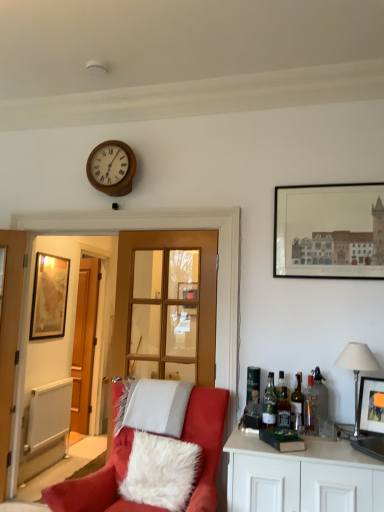
Locate an element on the screen. suede red chair at lower left is located at coordinates (98, 485).

In the scene shown: Measure the distance between point (291, 414) and camera.

The distance of point (291, 414) from camera is 2.46 meters.

Identify the location of clear glass wine bottle at right. [297, 406].

This screenshot has height=512, width=384. In order to click on green glass bottle at right, which is counted as the 4th bottle, starting from the right in this screenshot , I will do `click(269, 403)`.

This screenshot has height=512, width=384. What do you see at coordinates (49, 297) in the screenshot?
I see `matte gold picture frame at left, which appears as the 1th picture frame when viewed from the left` at bounding box center [49, 297].

This screenshot has width=384, height=512. What do you see at coordinates (357, 367) in the screenshot? I see `silver metallic lampshade at right` at bounding box center [357, 367].

The image size is (384, 512). What do you see at coordinates (283, 407) in the screenshot?
I see `translucent glass bottle at right, the 3th bottle from the right` at bounding box center [283, 407].

This screenshot has width=384, height=512. Find the location of `suede red chair at lower left`. suede red chair at lower left is located at coordinates (98, 485).

Considering the sizes of suede red chair at lower left and translucent glass bottle at right, the 4th bottle from the left, in the image, is suede red chair at lower left taller or shorter than translucent glass bottle at right, the 4th bottle from the left,?

Clearly, suede red chair at lower left is taller compared to translucent glass bottle at right, the 4th bottle from the left.

In terms of width, does suede red chair at lower left look wider or thinner when compared to translucent glass bottle at right, the 3th bottle from the right?

Clearly, suede red chair at lower left has more width compared to translucent glass bottle at right, the 3th bottle from the right.

Are suede red chair at lower left and translucent glass bottle at right, the 4th bottle from the left, located far from each other?

No, suede red chair at lower left is in close proximity to translucent glass bottle at right, the 4th bottle from the left.

Does green glass bottle at right, the 3th bottle from the left, have a lesser height compared to clear glass bottle at right, which is counted as the 1th bottle, starting from the right?

Indeed, green glass bottle at right, the 3th bottle from the left, has a lesser height compared to clear glass bottle at right, which is counted as the 1th bottle, starting from the right.

Is clear glass bottle at right, which is counted as the 1th bottle, starting from the right, inside green glass bottle at right, the 3th bottle from the left?

No, clear glass bottle at right, which is counted as the 1th bottle, starting from the right, is not surrounded by green glass bottle at right, the 3th bottle from the left.

Which is more to the left, green glass bottle at right, the 3th bottle from the left, or clear glass bottle at right, which ranks as the sixth bottle in left-to-right order?

Positioned to the left is green glass bottle at right, the 3th bottle from the left.

From the image's perspective, who appears lower, green glass bottle at right, which is counted as the 4th bottle, starting from the right, or clear glass bottle at right, which is counted as the 1th bottle, starting from the right?

green glass bottle at right, which is counted as the 4th bottle, starting from the right, appears lower in the image.

Is wooden door at left aimed at clear glass bottle at right, the 2th bottle from the right?

No, wooden door at left is not turned towards clear glass bottle at right, the 2th bottle from the right.

Which is more to the left, wooden door at left or clear glass bottle at right, the 2th bottle from the right?

From the viewer's perspective, wooden door at left appears more on the left side.

Between wooden door at left and clear glass bottle at right, the 5th bottle positioned from the left, which one is positioned in front?

Positioned in front is clear glass bottle at right, the 5th bottle positioned from the left.

From a real-world perspective, is wooden door at left physically below clear glass bottle at right, the 5th bottle positioned from the left?

No, from a real-world perspective, wooden door at left is not beneath clear glass bottle at right, the 5th bottle positioned from the left.

Could you tell me if translucent glass bottle at right, arranged as the first bottle when viewed from the left, is turned towards translucent glass bottle at right, arranged as the second bottle when viewed from the left?

No.

This screenshot has height=512, width=384. Find the location of `the 1st bottle in front of the translucent glass bottle at right, arranged as the second bottle when viewed from the left`. the 1st bottle in front of the translucent glass bottle at right, arranged as the second bottle when viewed from the left is located at coordinates (253, 412).

Between translucent glass bottle at right, arranged as the first bottle when viewed from the left, and translucent glass bottle at right, which is the 5th bottle in right-to-left order, which one has larger size?

With larger size is translucent glass bottle at right, which is the 5th bottle in right-to-left order.

Considering the points (244, 421) and (259, 389), which point is behind, point (244, 421) or point (259, 389)?

The point (259, 389) is farther from the camera.

From a real-world perspective, which object rests below the other?

suede red chair at lower left is physically lower.

Is suede red chair at lower left positioned far away from clear glass wine bottle at right?

That's not correct — suede red chair at lower left is a little close to clear glass wine bottle at right.

Identify the location of chair lying on the left of clear glass wine bottle at right. (98, 485).

Does translucent glass bottle at right, arranged as the second bottle when viewed from the left, have a larger size compared to clear glass bottle at right, the 5th bottle positioned from the left?

Yes.

Would you say translucent glass bottle at right, arranged as the second bottle when viewed from the left, contains clear glass bottle at right, the 2th bottle from the right?

No, clear glass bottle at right, the 2th bottle from the right, is not a part of translucent glass bottle at right, arranged as the second bottle when viewed from the left.

Does translucent glass bottle at right, which is the 5th bottle in right-to-left order, have a lesser height compared to clear glass bottle at right, the 2th bottle from the right?

No.

How distant is translucent glass bottle at right, arranged as the second bottle when viewed from the left, from clear glass bottle at right, the 2th bottle from the right?

translucent glass bottle at right, arranged as the second bottle when viewed from the left, is 14.90 inches from clear glass bottle at right, the 2th bottle from the right.

Is translucent glass bottle at right, which is the 5th bottle in right-to-left order, placed right next to clear glass wine bottle at right?

There is a gap between translucent glass bottle at right, which is the 5th bottle in right-to-left order, and clear glass wine bottle at right.

Is translucent glass bottle at right, which is the 5th bottle in right-to-left order, in front of or behind clear glass wine bottle at right in the image?

In the image, translucent glass bottle at right, which is the 5th bottle in right-to-left order, appears behind clear glass wine bottle at right.

From the image's perspective, count 2nd bottles upward from the clear glass wine bottle at right and point to it. Please provide its 2D coordinates.

[(252, 382)]

Does point (259, 384) come farther from viewer compared to point (299, 375)?

That is True.

I want to click on the 2nd bottle behind the suede red chair at lower left, counting from the anchor's position, so click(x=283, y=407).

From a real-world perspective, count 3rd bottles upward from the green glass bottle at right, which is counted as the 4th bottle, starting from the right, and point to it. Please provide its 2D coordinates.

[(321, 399)]

Based on the photo, when comparing their distances from white textured radiator at lower left, does white fluffy pillow at center, which ranks as the second pillow in front-to-back order, or matte paper picture frame at upper right, arranged as the 2th picture frame when viewed from the back, seem closer?

white fluffy pillow at center, which ranks as the second pillow in front-to-back order, is positioned closer to the anchor white textured radiator at lower left.

Based on their spatial positions, is clear glass wine bottle at right or matte paper picture frame at upper right, the first picture frame viewed from the right, closer to clear glass door at center?

Among the two, matte paper picture frame at upper right, the first picture frame viewed from the right, is located nearer to clear glass door at center.

When comparing their distances from clear glass bottle at right, the 2th bottle from the right, does matte gold picture frame at left, the second picture frame from the top, or wooden clock at upper center seem further?

matte gold picture frame at left, the second picture frame from the top, is further to clear glass bottle at right, the 2th bottle from the right.

Which object lies nearer to the anchor point suede red chair at lower left, matte gold picture frame at left, the second picture frame from the top, or translucent glass bottle at right, arranged as the second bottle when viewed from the left?

translucent glass bottle at right, arranged as the second bottle when viewed from the left, is positioned closer to the anchor suede red chair at lower left.

From the image, which object appears to be nearer to clear glass door at center, translucent glass bottle at right, the 3th bottle from the right, or white fluffy pillow at center, arranged as the 1th pillow when viewed from the back?

white fluffy pillow at center, arranged as the 1th pillow when viewed from the back, lies closer to clear glass door at center than the other object.

Which object lies nearer to the anchor point clear glass bottle at right, which is counted as the 1th bottle, starting from the right, translucent glass bottle at right, which is the 5th bottle in right-to-left order, or white fluffy pillow at lower center, acting as the first pillow starting from the front?

Based on the image, translucent glass bottle at right, which is the 5th bottle in right-to-left order, appears to be nearer to clear glass bottle at right, which is counted as the 1th bottle, starting from the right.

Which object lies further to the anchor point clear glass bottle at right, the 5th bottle positioned from the left, translucent glass bottle at right, arranged as the first bottle when viewed from the left, or green glass bottle at right, the 3th bottle from the left?

translucent glass bottle at right, arranged as the first bottle when viewed from the left.

Which object lies nearer to the anchor point translucent glass bottle at right, which is the 5th bottle in right-to-left order, translucent glass bottle at right, the 4th bottle from the left, or clear glass wine bottle at right?

The object closer to translucent glass bottle at right, which is the 5th bottle in right-to-left order, is translucent glass bottle at right, the 4th bottle from the left.

Locate an element on the screen. wine bottle located between translucent glass bottle at right, the 3th bottle from the right, and silver metallic lampshade at right in the left-right direction is located at coordinates (297, 406).

Locate an element on the screen. radiator between matte gold picture frame at left, which appears as the 1th picture frame when viewed from the left, and translucent glass bottle at right, the 3th bottle from the right is located at coordinates (49, 415).

At what (x,y) coordinates should I click in order to perform the action: click on picture frame between wooden door at left and matte paper picture frame at upper right, which is the first picture frame from front to back. Please return your answer as a coordinate pair (x, y). Image resolution: width=384 pixels, height=512 pixels. Looking at the image, I should click on (49, 297).

The height and width of the screenshot is (512, 384). Identify the location of pillow located between white fluffy pillow at lower center, the second pillow from the back, and white textured radiator at lower left in the depth direction. (153, 406).